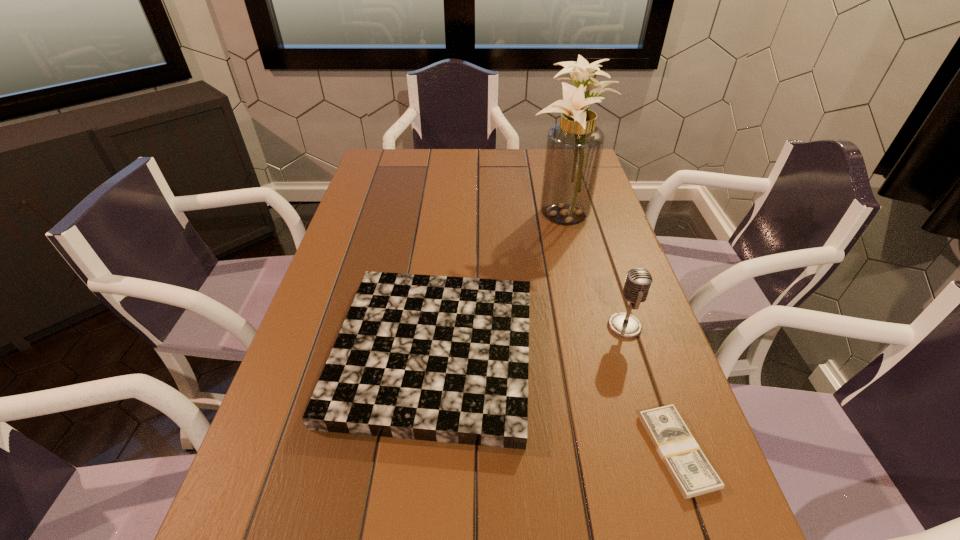
Identify the location of the farthest object. The height and width of the screenshot is (540, 960). (574, 147).

What are the coordinates of `the tallest object` in the screenshot? It's located at pyautogui.click(x=574, y=147).

Image resolution: width=960 pixels, height=540 pixels. In order to click on the third shortest object in this screenshot , I will do `click(638, 282)`.

At what (x,y) coordinates should I click in order to perform the action: click on the second shortest object. Please return your answer as a coordinate pair (x, y). Looking at the image, I should click on (437, 358).

You are a GUI agent. You are given a task and a screenshot of the screen. Output one action in this format:
    pyautogui.click(x=<x>, y=<y>)
    Task: Click on the checkerboard
    The height and width of the screenshot is (540, 960).
    Given the screenshot: What is the action you would take?
    pyautogui.click(x=437, y=358)

Image resolution: width=960 pixels, height=540 pixels. I want to click on dollar, so click(x=692, y=473).

At what (x,y) coordinates should I click in order to perform the action: click on vacant area situated 0.240m on the front of the tallest object. Please return your answer as a coordinate pair (x, y). This screenshot has width=960, height=540. Looking at the image, I should click on (582, 294).

Where is `vacant area situated on the front of the third shortest object`? vacant area situated on the front of the third shortest object is located at coordinates (663, 446).

Identify the location of vacant space located on the left of the leftmost object. (304, 352).

Image resolution: width=960 pixels, height=540 pixels. What are the coordinates of `free region located 0.050m on the front of the dollar` in the screenshot? It's located at (706, 535).